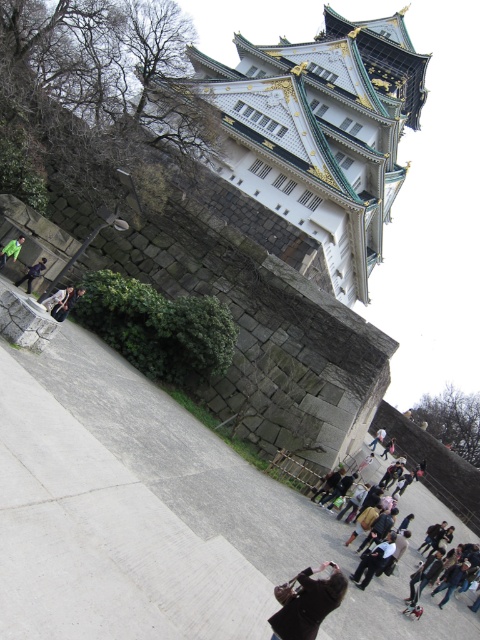
You are a tourist standing at the entrance of the castle grounds. You want to take a photo of the white stone tower at upper center. Where should you stand to capture it in the frame?

To capture the white stone tower at upper center in your photo, position yourself so that the tower is centered at coordinates approximately 0.212 on the horizontal axis and 0.669 on the vertical axis relative to the frame.

You are a tourist visiting the castle and want to take a photo of the dark brown leather coat at center and the dark blue jeans at lower left. Based on their positions, which object should you focus on first to ensure both are in the frame?

The dark brown leather coat at center is positioned under the dark blue jeans at lower left, so you should focus on the dark blue jeans at lower left first to ensure both are in the frame.

Based on the photo, you are a visitor at the castle and want to take a photo of both the point at coordinates [60,292] and the point at coordinates [14,248]. Which point should you stand closer to in order to have both points visible in your camera frame?

You should stand closer to point [14,248] because point [60,292] is in front of it, so positioning yourself near the rear point will allow both to be captured in the frame.